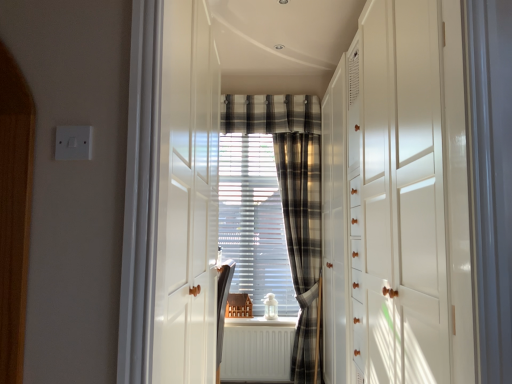
Question: Is plaid fabric curtain at center to the left or to the right of plaid fabric at center in the image?

Choices:
 (A) left
 (B) right

Answer: (B)

Question: From a real-world perspective, is plaid fabric curtain at center above or below plaid fabric at center?

Choices:
 (A) above
 (B) below

Answer: (B)

Question: Considering the real-world distances, which object is farthest from the plaid fabric curtain at center?

Choices:
 (A) plaid fabric curtain at center
 (B) white glossy dresser at right
 (C) white matte radiator at center
 (D) plaid fabric at center

Answer: (B)

Question: Considering the real-world distances, which object is farthest from the plaid fabric curtain at center?

Choices:
 (A) plaid fabric at center
 (B) plaid fabric curtain at center
 (C) white matte radiator at center
 (D) white glossy dresser at right

Answer: (D)